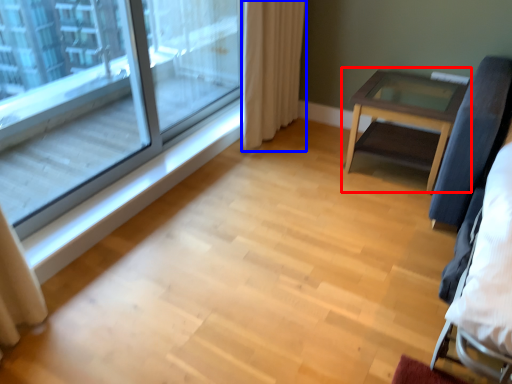
Question: Which object is further to the camera taking this photo, table (highlighted by a red box) or curtain (highlighted by a blue box)?

Choices:
 (A) table
 (B) curtain

Answer: (B)